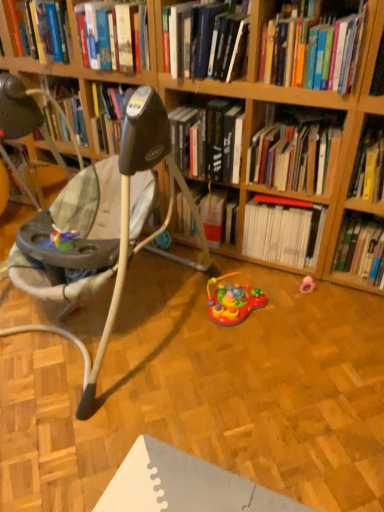
Locate an element on the screen. The width and height of the screenshot is (384, 512). free space to the left of pink rubber pacifier at lower right, the second toy from the left is located at coordinates (280, 290).